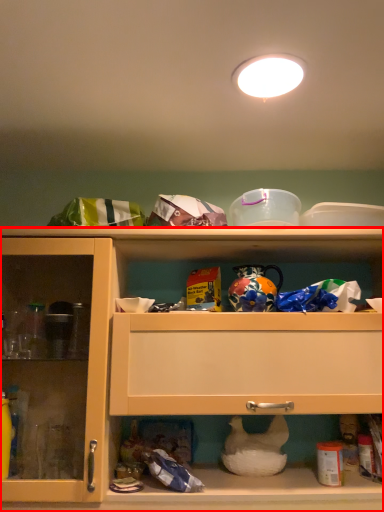
Question: Where is cabinetry (annotated by the red box) located in relation to lighting in the image?

Choices:
 (A) left
 (B) right

Answer: (A)